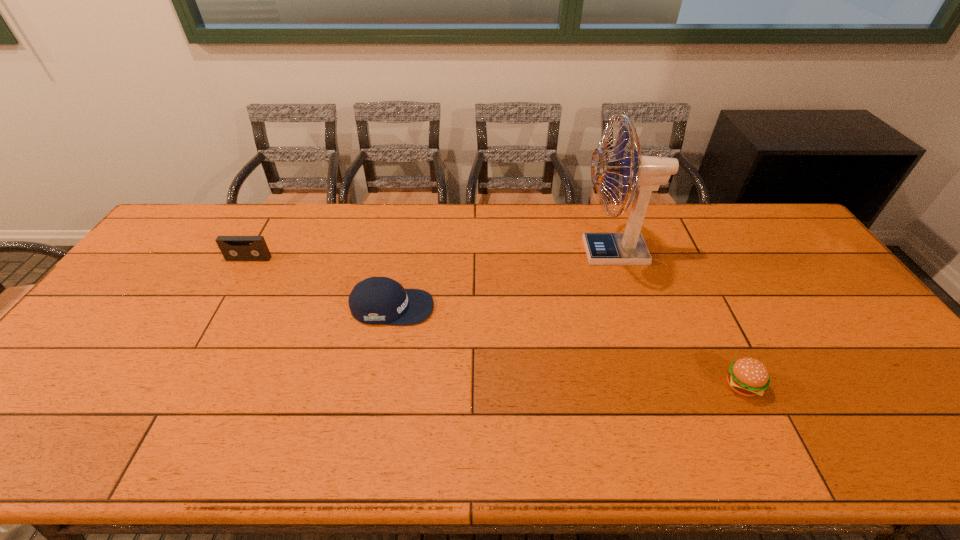
Image resolution: width=960 pixels, height=540 pixels. In order to click on blank space that satisfies the following two spatial constraints: 1. on the front-facing side of the hamburger; 2. on the right side of the third object from right to left in this screenshot , I will do `click(377, 386)`.

Where is `free location that satisfies the following two spatial constraints: 1. on the front-facing side of the third object from left to right; 2. on the front-facing side of the leftmost object`? Image resolution: width=960 pixels, height=540 pixels. free location that satisfies the following two spatial constraints: 1. on the front-facing side of the third object from left to right; 2. on the front-facing side of the leftmost object is located at coordinates (615, 259).

This screenshot has height=540, width=960. Identify the location of free spot that satisfies the following two spatial constraints: 1. on the front-facing side of the rightmost object; 2. on the right side of the second object from left to right. (377, 386).

You are a GUI agent. You are given a task and a screenshot of the screen. Output one action in this format:
    pyautogui.click(x=<x>, y=<y>)
    Task: Click on the free location that satisfies the following two spatial constraints: 1. on the front-facing side of the nearest object; 2. on the right side of the second nearest object
    The width and height of the screenshot is (960, 540).
    Given the screenshot: What is the action you would take?
    pyautogui.click(x=377, y=386)

In order to click on vacant area that satisfies the following two spatial constraints: 1. on the front-facing side of the leftmost object; 2. on the right side of the nearest object in this screenshot , I will do `click(177, 386)`.

In order to click on vacant space that satisfies the following two spatial constraints: 1. on the back side of the hamburger; 2. on the front-facing side of the second nearest object in this screenshot , I will do `click(704, 307)`.